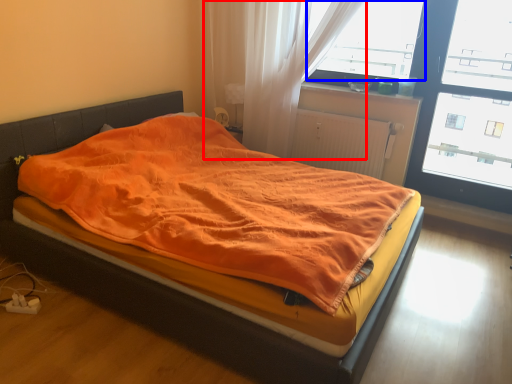
Question: Which of the following is the closest to the observer, curtain (highlighted by a red box) or window screen (highlighted by a blue box)?

Choices:
 (A) curtain
 (B) window screen

Answer: (A)